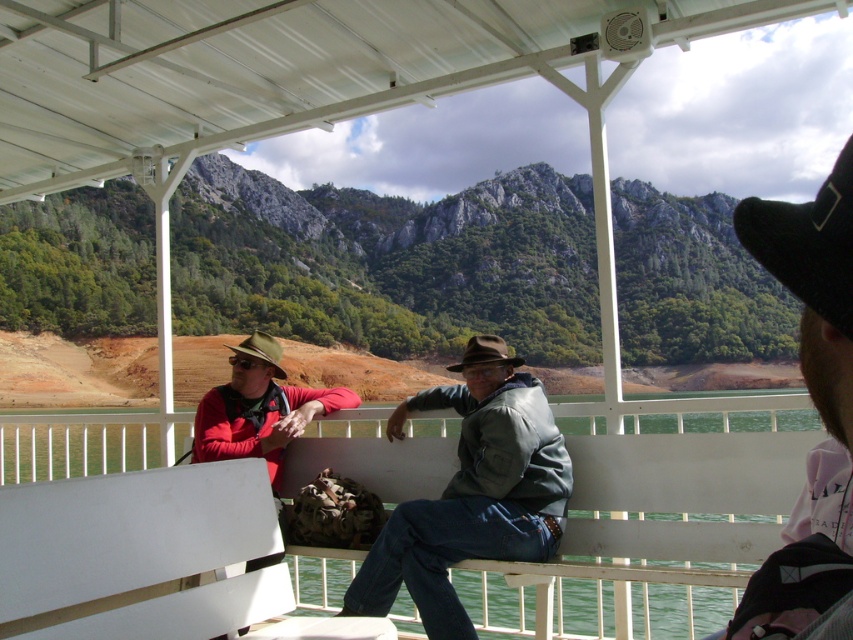
Question: Is green forested mountain at center above black knitted cowboy hat at upper right?

Choices:
 (A) yes
 (B) no

Answer: (A)

Question: Which point appears closest to the camera in this image?

Choices:
 (A) (601, 468)
 (B) (485, 333)
 (C) (219, 433)

Answer: (A)

Question: Considering the relative positions of matte brown hat at upper right and brown felt cowboy hat at center in the image provided, where is matte brown hat at upper right located with respect to brown felt cowboy hat at center?

Choices:
 (A) below
 (B) above

Answer: (A)

Question: Which of these objects is positioned farthest from the black knitted cowboy hat at upper right?

Choices:
 (A) white matte bench at lower left
 (B) green matte jacket at center

Answer: (A)

Question: Can you confirm if white plastic bench at center is positioned below brown felt cowboy hat at center?

Choices:
 (A) no
 (B) yes

Answer: (B)

Question: Which object is positioned closest to the black knitted cowboy hat at upper right?

Choices:
 (A) matte red jacket at left
 (B) green matte jacket at center
 (C) white matte bench at lower left

Answer: (B)